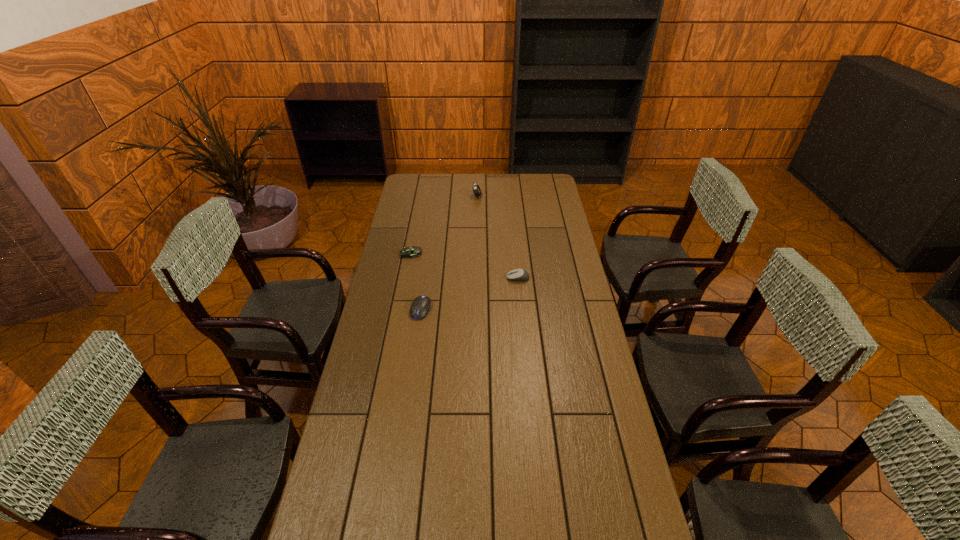
I want to click on unoccupied area between the shortest computer mouse and the third farthest object, so click(465, 266).

Locate an element on the screen. Image resolution: width=960 pixels, height=540 pixels. free space between the nearest computer mouse and the alarm clock is located at coordinates (449, 253).

Image resolution: width=960 pixels, height=540 pixels. I want to click on vacant area that lies between the farthest computer mouse and the rightmost object, so click(465, 266).

Locate an element on the screen. The width and height of the screenshot is (960, 540). unoccupied position between the farthest object and the third farthest object is located at coordinates (497, 238).

Identify the location of free space between the second farthest object and the rightmost object. point(465,266).

This screenshot has height=540, width=960. What are the coordinates of `empty space between the third nearest object and the tallest object` in the screenshot? It's located at (444, 225).

Where is `unoccupied position between the rightmost computer mouse and the nearest object`? The width and height of the screenshot is (960, 540). unoccupied position between the rightmost computer mouse and the nearest object is located at coordinates (469, 294).

This screenshot has height=540, width=960. What are the coordinates of `object that is the nearest to the second nearest computer mouse` in the screenshot? It's located at (420, 306).

Choose which object is the second nearest neighbor to the nearest computer mouse. Please provide its 2D coordinates. Your answer should be formatted as a tuple, i.e. [(x, y)], where the tuple contains the x and y coordinates of a point satisfying the conditions above.

[(517, 274)]

Locate an element on the screen. Image resolution: width=960 pixels, height=540 pixels. the closest computer mouse relative to the alarm clock is located at coordinates (406, 252).